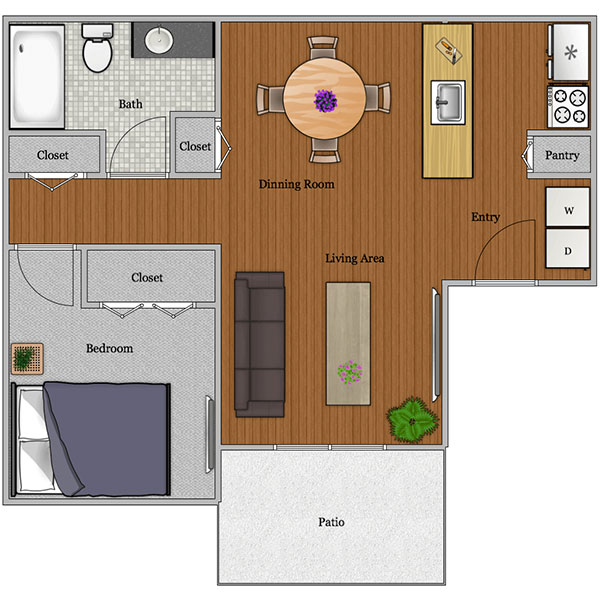
I want to click on kitchen area, so click(508, 102).